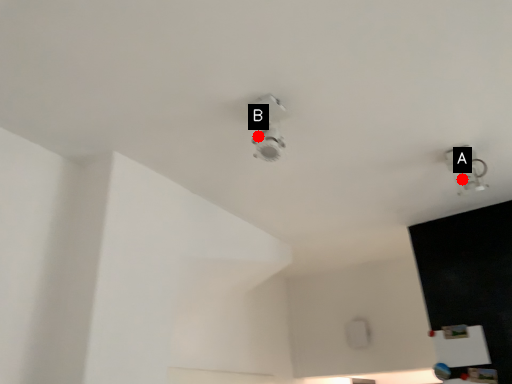
Question: Two points are circled on the image, labeled by A and B beside each circle. Among these points, which one is farthest from the camera?

Choices:
 (A) A is further
 (B) B is further

Answer: (A)